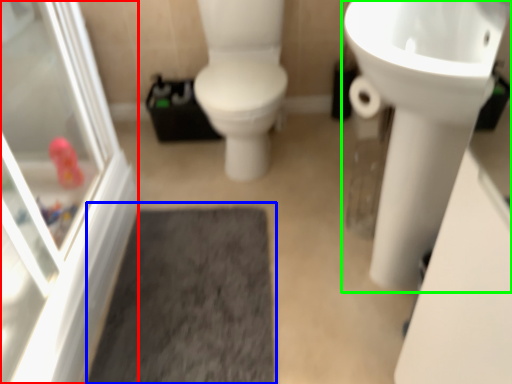
Question: Based on their relative distances, which object is farther from screen door (highlighted by a red box)? Choose from bath mat (highlighted by a blue box) and sink (highlighted by a green box).

Choices:
 (A) bath mat
 (B) sink

Answer: (B)